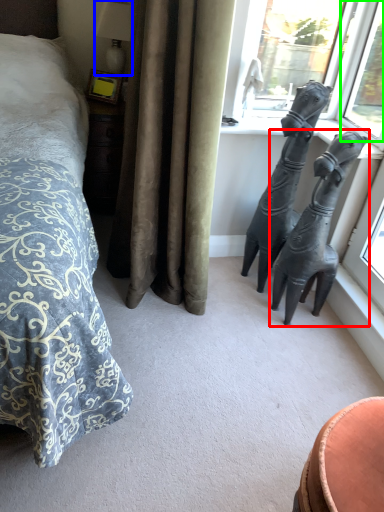
Question: Estimate the real-world distances between objects in this image. Which object is farther from statue (sculpture) (highlighted by a red box), lamp (highlighted by a blue box) or window (highlighted by a green box)?

Choices:
 (A) lamp
 (B) window

Answer: (A)